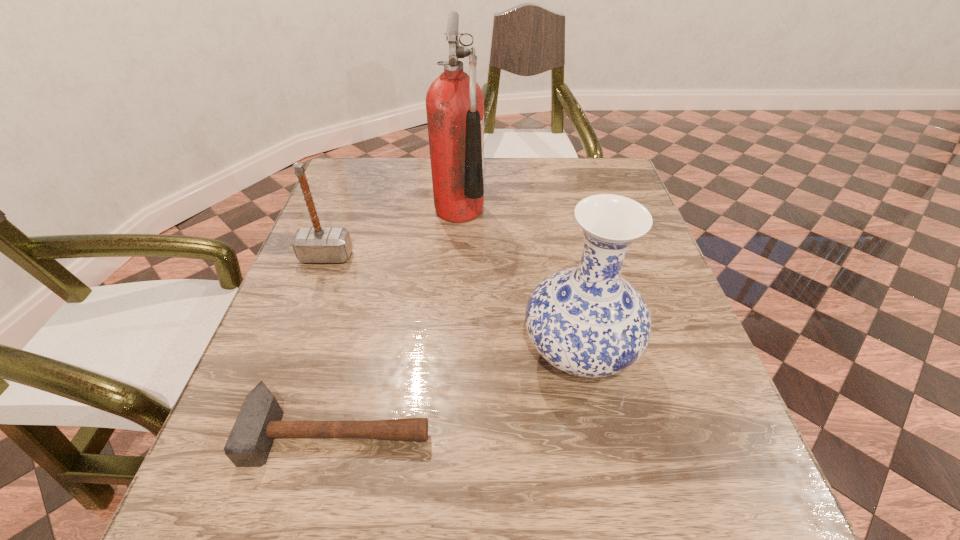
I want to click on fire extinguisher, so click(x=454, y=102).

Where is `the farthest object`? the farthest object is located at coordinates (454, 102).

Where is `the rightmost object`? the rightmost object is located at coordinates (587, 321).

Find the location of a particular element. This screenshot has width=960, height=540. vase is located at coordinates (587, 321).

This screenshot has width=960, height=540. Find the location of `the second farthest object`. the second farthest object is located at coordinates (316, 244).

Locate an element on the screen. This screenshot has width=960, height=540. the second shortest object is located at coordinates (316, 244).

Where is `the shortest object`? This screenshot has width=960, height=540. the shortest object is located at coordinates (258, 423).

Locate an element on the screen. the shorter hammer is located at coordinates (258, 423).

Identify the location of vacant space located 0.100m on the front of the fire extinguisher near the operation label. This screenshot has width=960, height=540. (522, 210).

The width and height of the screenshot is (960, 540). In order to click on vacant space located on the back of the rightmost object in this screenshot , I will do `click(550, 210)`.